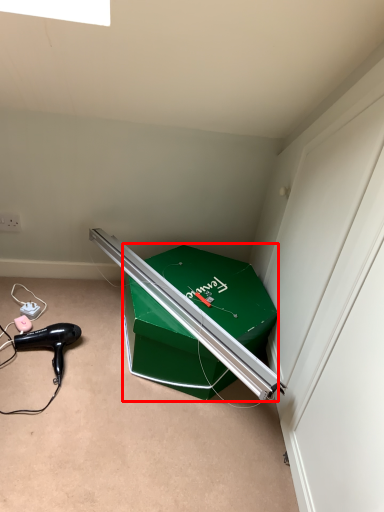
Question: From the image's perspective, where is box (annotated by the red box) located relative to hair drier?

Choices:
 (A) above
 (B) below

Answer: (A)